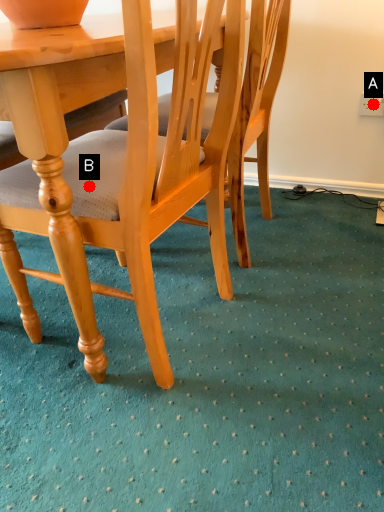
Question: Two points are circled on the image, labeled by A and B beside each circle. Which of the following is the closest to the observer?

Choices:
 (A) A is closer
 (B) B is closer

Answer: (B)